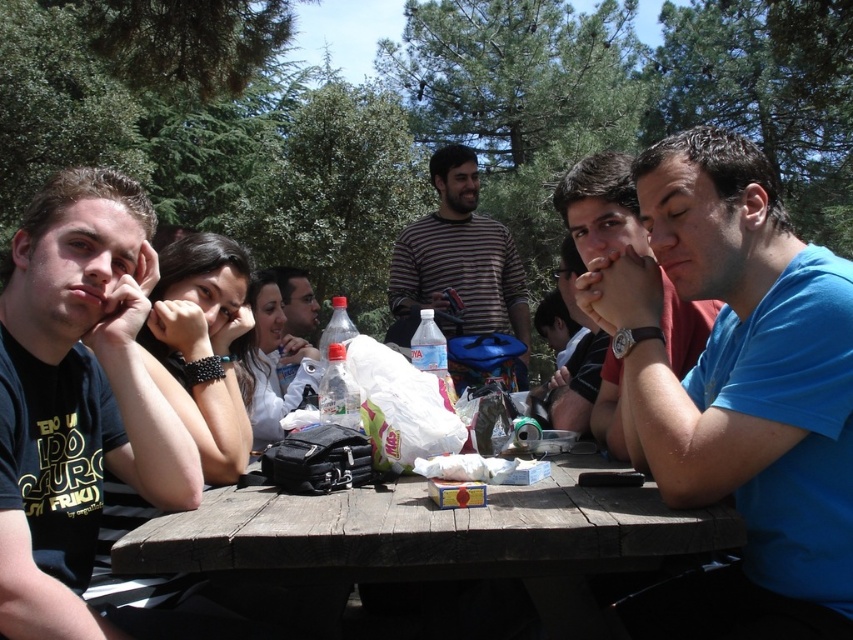
Identify the location of blue cotton shirt at center. (738, 388).

Can you confirm if blue cotton shirt at center is positioned to the right of blue fabric shirt at center?

Incorrect, blue cotton shirt at center is not on the right side of blue fabric shirt at center.

Between point (851, 307) and point (610, 189), which one is positioned behind?

The point (610, 189) is behind.

Image resolution: width=853 pixels, height=640 pixels. I want to click on blue cotton shirt at center, so click(x=738, y=388).

Does blue cotton shirt at center appear under matte blue shirt at right?

Indeed, blue cotton shirt at center is positioned under matte blue shirt at right.

Describe the element at coordinates (738, 388) in the screenshot. I see `blue cotton shirt at center` at that location.

What do you see at coordinates (738, 388) in the screenshot? The width and height of the screenshot is (853, 640). I see `blue cotton shirt at center` at bounding box center [738, 388].

Find the location of a particular element. blue cotton shirt at center is located at coordinates point(738,388).

Who is shorter, black matte t-shirt at left or matte black jacket at center?

matte black jacket at center is shorter.

Does point (22, 628) come behind point (294, 285)?

No, (22, 628) is in front of (294, 285).

This screenshot has width=853, height=640. Identify the location of black matte t-shirt at left. (77, 397).